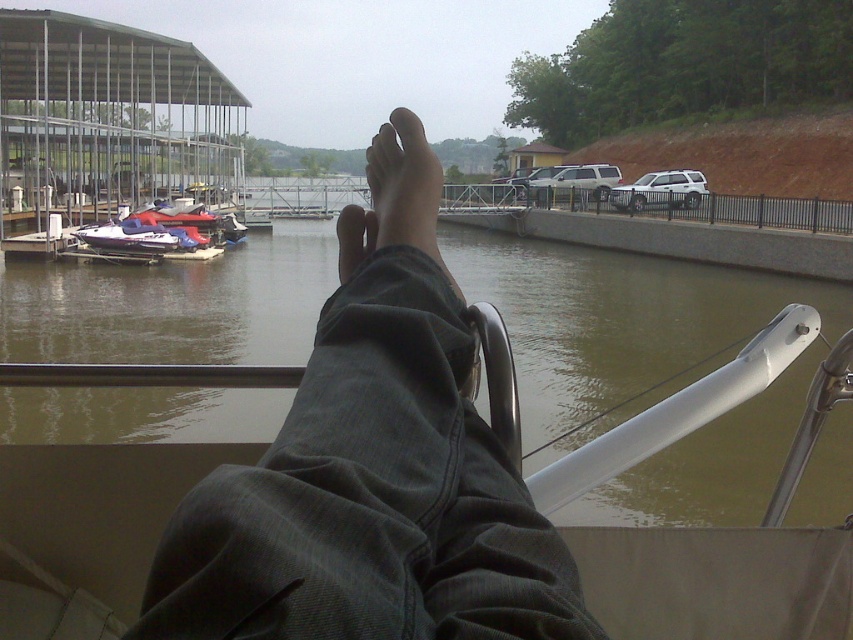
You are standing on the dock and want to reach the point marked at coordinates point (292,230). If your maximum comfortable walking distance is 50 meters, can you comfortably walk to that point without needing to rest?

The distance between you and point (292,230) is 45.60 meters, which is within your maximum comfortable walking distance of 50 meters. Therefore, you can comfortably walk to that point without needing to rest.

You are a photographer taking a closeup shot of the feet on the boat. The skinny barefoot at center and the matte black foot at center are both in your frame. Which foot appears larger in the photo?

The skinny barefoot at center appears larger in the photo because it is bigger than the matte black foot at center according to the description.